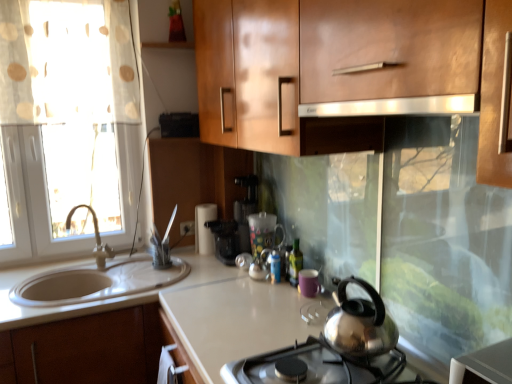
This screenshot has height=384, width=512. Find the location of `free location to the left of purple matte mug at center, the third appliance from the back`. free location to the left of purple matte mug at center, the third appliance from the back is located at coordinates (271, 298).